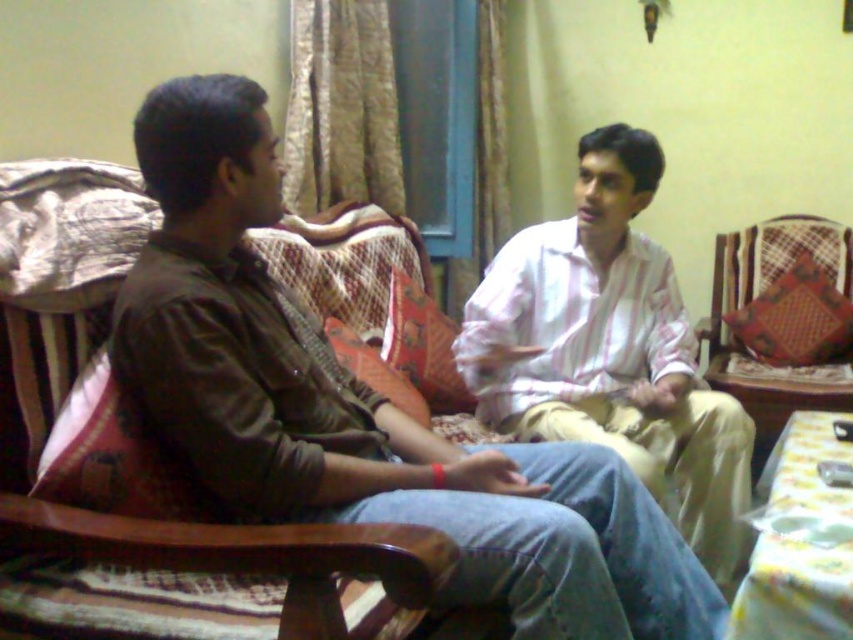
Does dark brown shirt at left appear on the left side of pink striped shirt at center?

Correct, you'll find dark brown shirt at left to the left of pink striped shirt at center.

Looking at this image, who is more distant from viewer, [280,340] or [564,433]?

Point [564,433]

You are a GUI agent. You are given a task and a screenshot of the screen. Output one action in this format:
    pyautogui.click(x=<x>, y=<y>)
    Task: Click on the dark brown shirt at left
    The image size is (853, 640).
    Given the screenshot: What is the action you would take?
    pyautogui.click(x=360, y=408)

Who is taller, dark brown shirt at left or wooden chair at right?

With more height is wooden chair at right.

This screenshot has width=853, height=640. Find the location of `dark brown shirt at left`. dark brown shirt at left is located at coordinates pos(360,408).

Is point (666, 564) closer to viewer compared to point (770, 272)?

That is True.

Locate an element on the screen. dark brown shirt at left is located at coordinates (360, 408).

From the picture: Is pink striped shirt at center taller than wooden chair at right?

Correct, pink striped shirt at center is much taller as wooden chair at right.

Is pink striped shirt at center bigger than wooden chair at right?

No, pink striped shirt at center is not bigger than wooden chair at right.

This screenshot has width=853, height=640. Find the location of `pink striped shirt at center`. pink striped shirt at center is located at coordinates (610, 352).